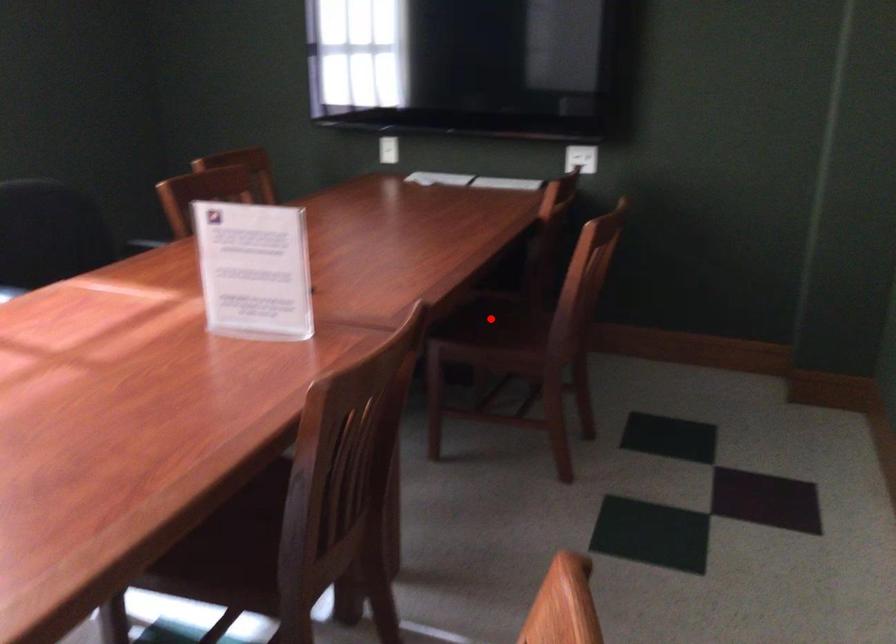
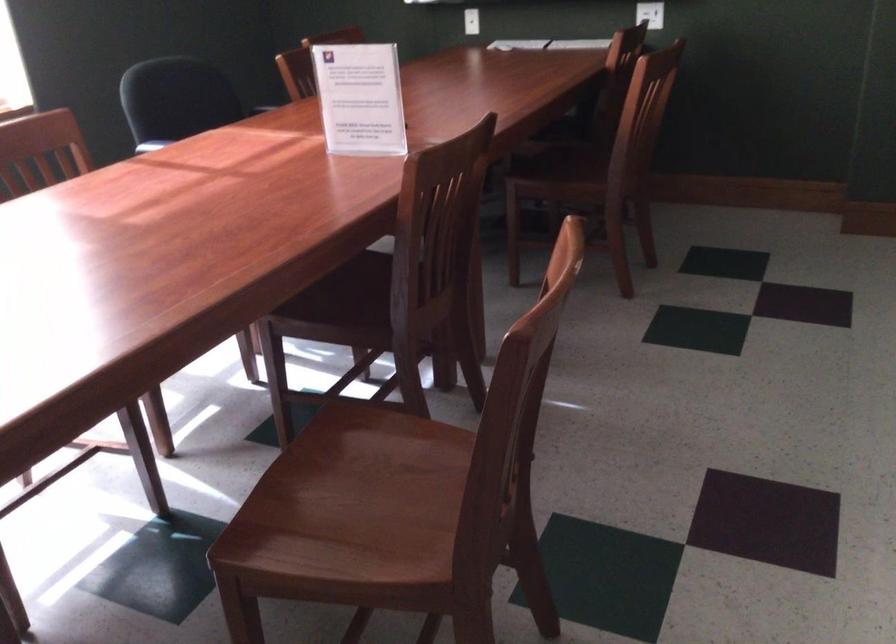
In the second image, find the point that corresponds to the highlighted location in the first image.

(561, 158)